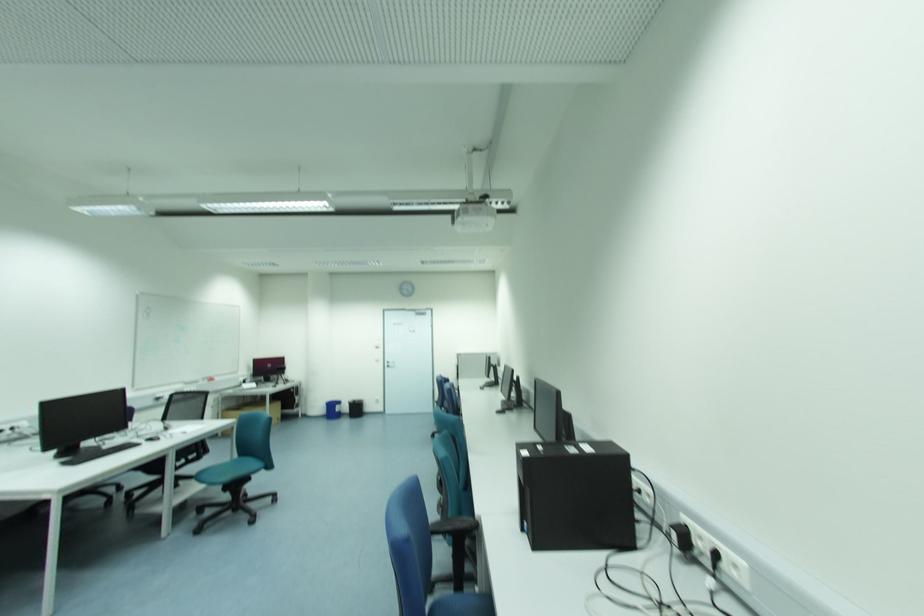
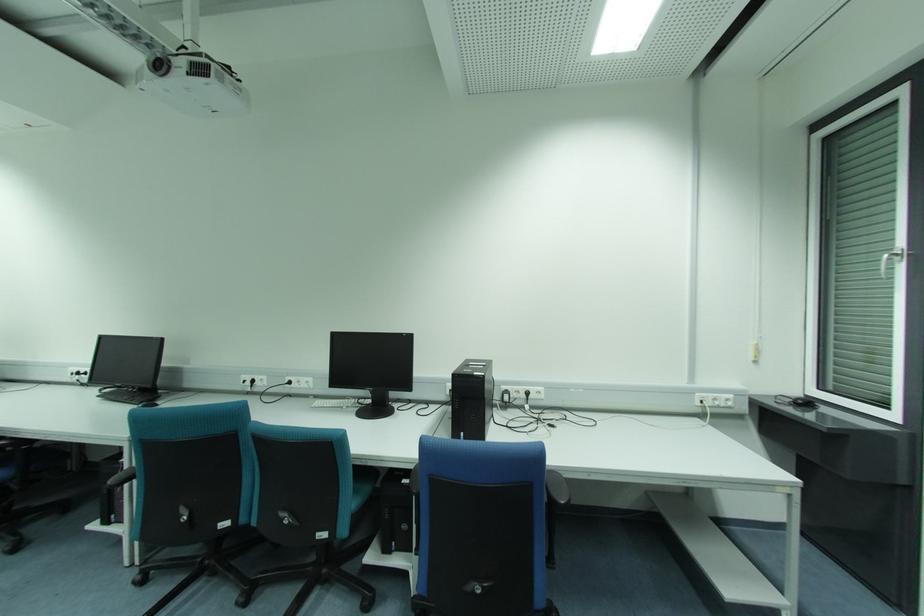
Locate, in the second image, the point that corresponds to point (719, 556) in the first image.

(528, 394)